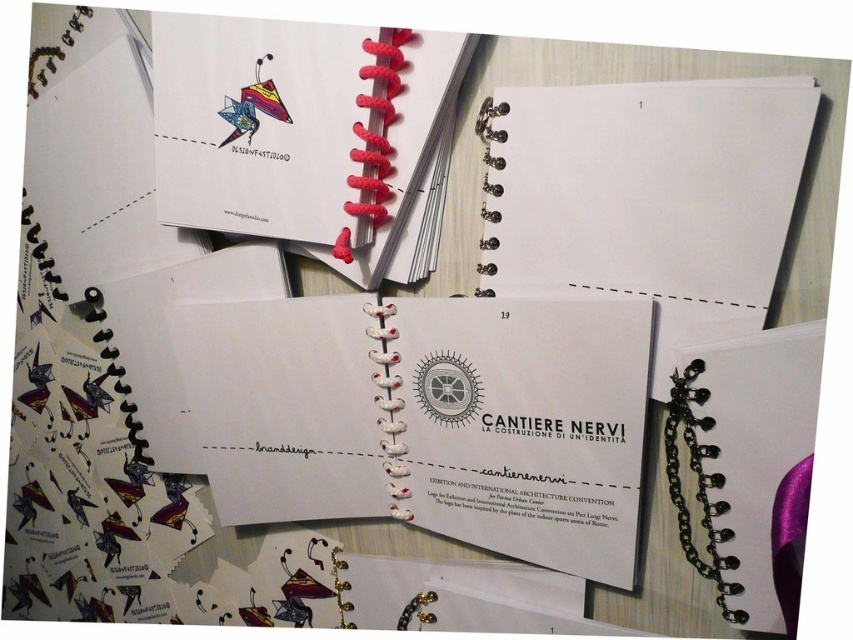
You are standing at the origin point of the image. Which of the two points, point (378, 131) or point (747, 509), is closer to you?

Point (747, 509) is closer to you because it is in front of point (378, 131).

You are an architect looking at the scene described. You need to place a small model of your design on the white paper notebook at center. To ensure it fits, you need to know the notebook dimensions. Can you determine if the notebook is wider than 15 cm?

The white paper notebook at center has a width of 15 cm, so it is exactly 15 cm wide. Therefore, the notebook is not wider than 15 cm.

What are the coordinates of the white paper at center?

The white paper at center is located at coordinates [646,196].